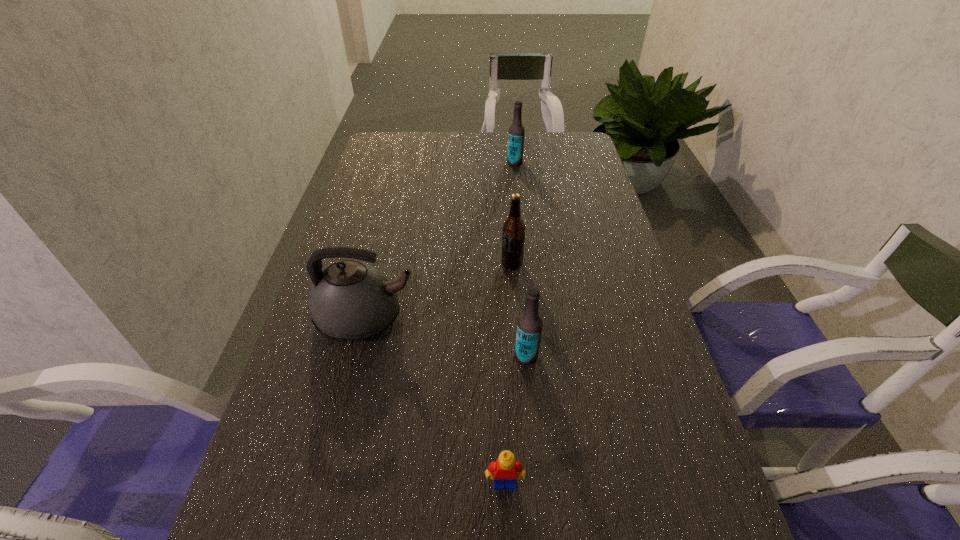
Locate an element on the screen. The width and height of the screenshot is (960, 540). free point located on the label of the fourth nearest object is located at coordinates (431, 264).

Where is `vacant space located on the label of the fourth nearest object`? vacant space located on the label of the fourth nearest object is located at coordinates coord(372,264).

Find the location of a particular element. The width and height of the screenshot is (960, 540). vacant space located at the spout of the kettle is located at coordinates (472, 318).

This screenshot has width=960, height=540. In order to click on vacant space located 0.180m on the label of the nearest beer bottle in this screenshot , I will do `click(434, 356)`.

Where is `free space located 0.300m on the label of the nearest beer bottle`? free space located 0.300m on the label of the nearest beer bottle is located at coordinates (379, 356).

Locate an element on the screen. This screenshot has height=540, width=960. vacant space situated on the label of the nearest beer bottle is located at coordinates (429, 356).

The width and height of the screenshot is (960, 540). Find the location of `object located at the far edge`. object located at the far edge is located at coordinates (516, 134).

Find the location of a particular element. The width and height of the screenshot is (960, 540). object that is at the left edge is located at coordinates (349, 300).

Find the location of `free space at the far edge`. free space at the far edge is located at coordinates (446, 141).

Locate an element on the screen. vacant space at the left edge of the desktop is located at coordinates (368, 184).